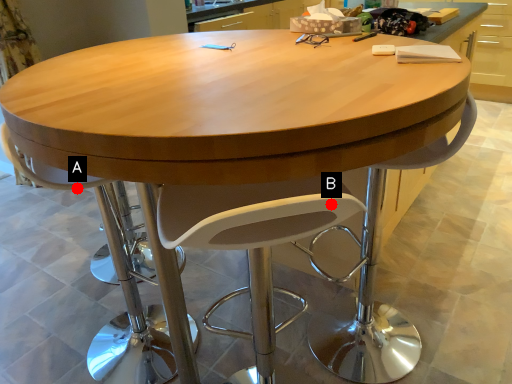
Question: Two points are circled on the image, labeled by A and B beside each circle. Which of the following is the closest to the observer?

Choices:
 (A) A is closer
 (B) B is closer

Answer: (B)